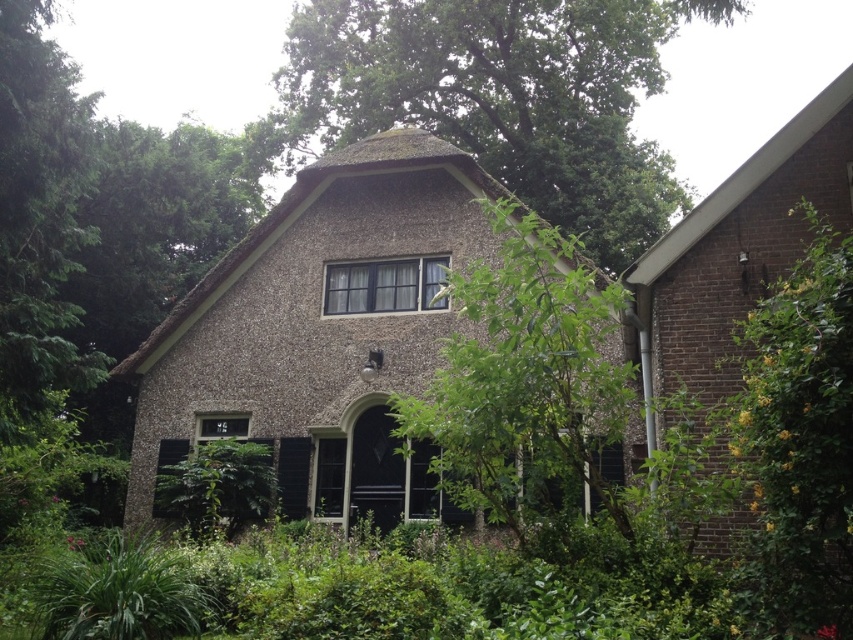
Is green leafy tree at upper center positioned before green leafy tree at center?

That is True.

Between point (566, 29) and point (593, 416), which one is positioned behind?

Positioned behind is point (566, 29).

Where is `green leafy tree at upper center`? Image resolution: width=853 pixels, height=640 pixels. green leafy tree at upper center is located at coordinates (497, 97).